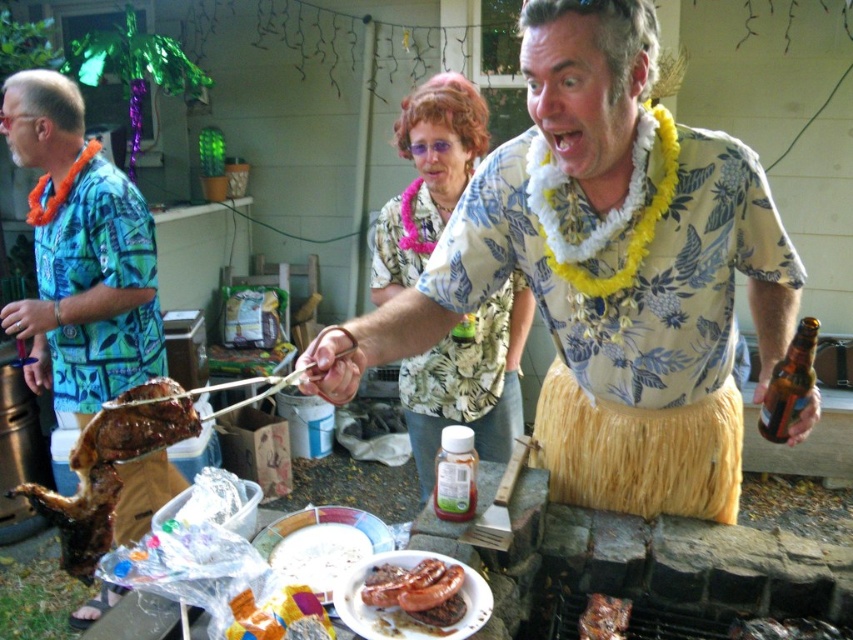
Question: Which point is closer to the camera?

Choices:
 (A) (413, 264)
 (B) (102, 358)
 (C) (10, 492)
 (D) (605, 604)

Answer: (C)

Question: Is pink fabric lei at center thinner than charred meat at center?

Choices:
 (A) yes
 (B) no

Answer: (B)

Question: Which object appears closest to the camera in this image?

Choices:
 (A) golden crispy roasted chicken at center
 (B) yellow grass skirt at center
 (C) charred meat at center

Answer: (B)

Question: Which of the following is the closest to the observer?

Choices:
 (A) (625, 602)
 (B) (567, 358)

Answer: (B)

Question: Does blue printed shirt at left lie behind brown matte sausages at center?

Choices:
 (A) no
 (B) yes

Answer: (B)

Question: Can you confirm if blue printed shirt at left is wider than brown matte sausages at center?

Choices:
 (A) no
 (B) yes

Answer: (B)